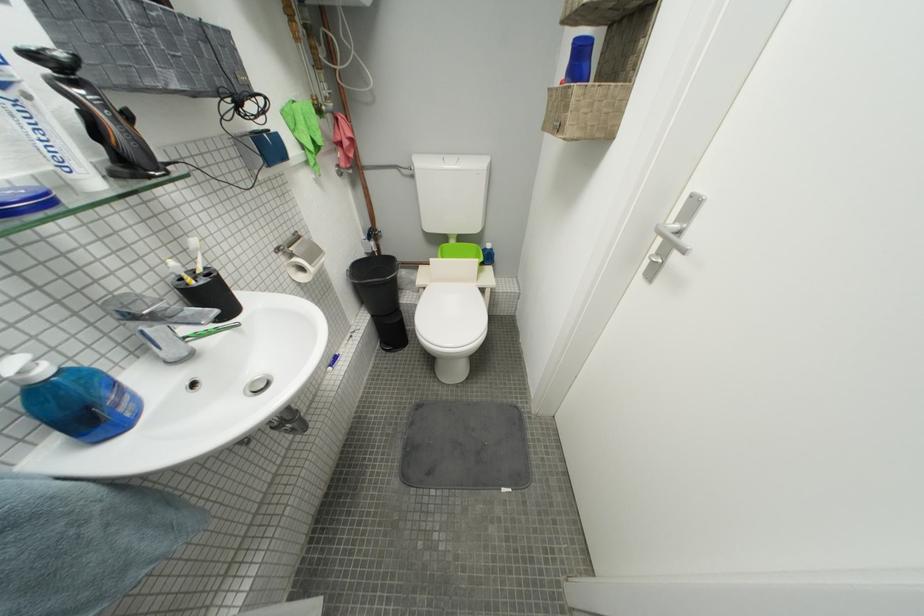
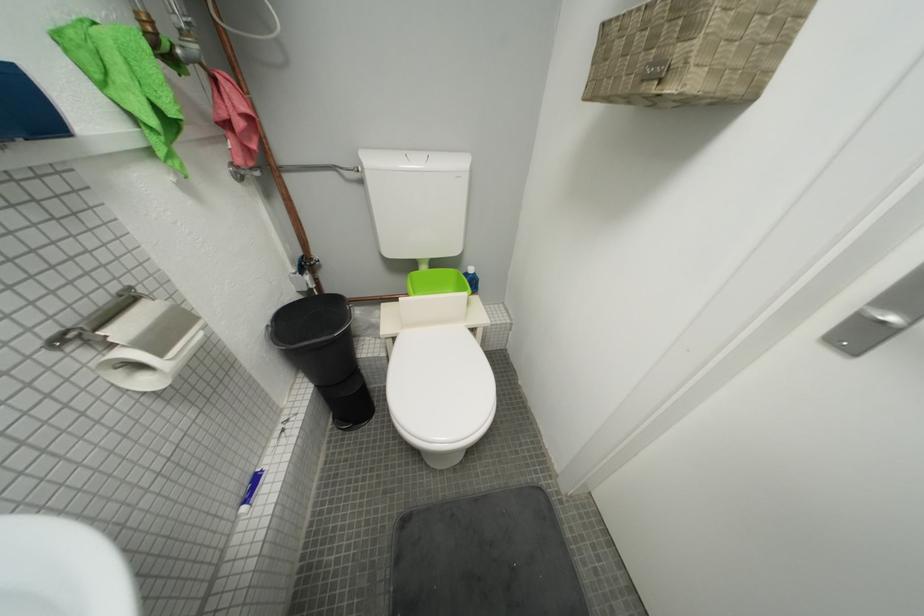
Question: The camera is either moving clockwise (left) or counter-clockwise (right) around the object. The first image is from the beginning of the video and the second image is from the end. Is the camera moving left or right when shooting the video?

Choices:
 (A) Left
 (B) Right

Answer: (A)